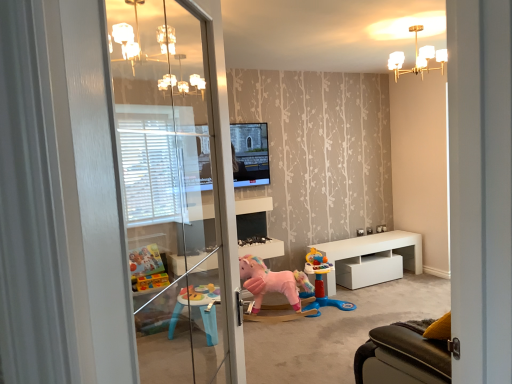
At what (x,y) coordinates should I click in order to perform the action: click on empty space that is ontop of white glossy table at lower right. Please return your answer as a coordinate pair (x, y). The image size is (512, 384). Looking at the image, I should click on (366, 238).